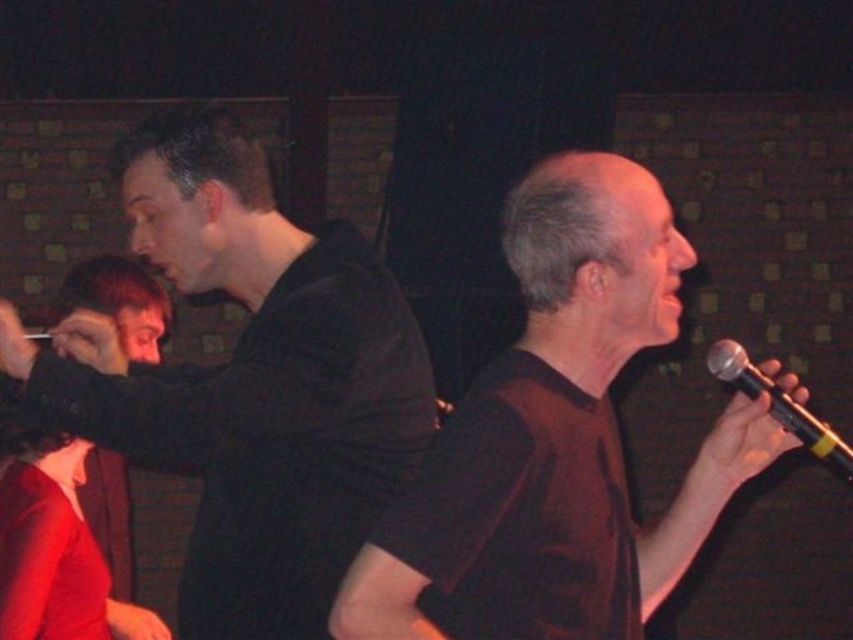
From the picture: You are a photographer at the event and want to capture a photo where the brown matte shirt at right and the black metallic microphone at right are both clearly visible. Considering their sizes, which object will appear larger in the photo?

The brown matte shirt at right is much taller than the black metallic microphone at right, so it will appear larger in the photo.